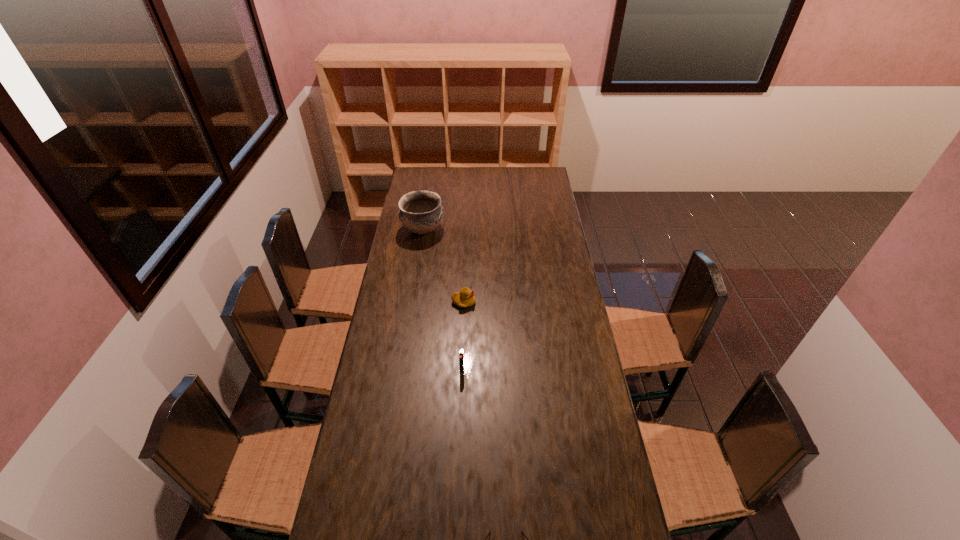
The image size is (960, 540). I want to click on pottery, so click(421, 212).

You are a GUI agent. You are given a task and a screenshot of the screen. Output one action in this format:
    pyautogui.click(x=<x>, y=<y>)
    Task: Click on the tallest object
    This screenshot has height=540, width=960.
    Given the screenshot: What is the action you would take?
    pyautogui.click(x=421, y=212)

You are a GUI agent. You are given a task and a screenshot of the screen. Output one action in this format:
    pyautogui.click(x=<x>, y=<y>)
    Task: Click on the third farthest object
    Image resolution: width=960 pixels, height=540 pixels.
    Given the screenshot: What is the action you would take?
    pyautogui.click(x=461, y=357)

At what (x,y) coordinates should I click in order to perform the action: click on the second tallest object. Please return your answer as a coordinate pair (x, y). Looking at the image, I should click on (461, 357).

I want to click on the third nearest object, so click(x=465, y=297).

Locate an element on the screen. the third tallest object is located at coordinates (465, 297).

This screenshot has height=540, width=960. Identify the location of vacant space located on the right of the leftmost object. (x=481, y=230).

Image resolution: width=960 pixels, height=540 pixels. I want to click on vacant space located on the right of the third farthest object, so click(x=565, y=370).

Where is `vacant space positioned on the front-facing side of the second farthest object`? This screenshot has width=960, height=540. vacant space positioned on the front-facing side of the second farthest object is located at coordinates (488, 302).

At what (x,y) coordinates should I click in order to perform the action: click on object at the left edge. Please return your answer as a coordinate pair (x, y). This screenshot has width=960, height=540. Looking at the image, I should click on (421, 212).